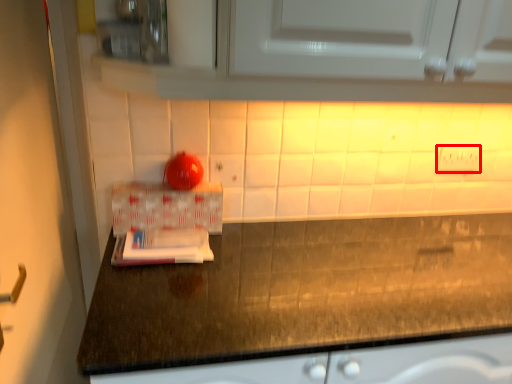
Question: From the image's perspective, where is electric outlet (annotated by the red box) located relative to box?

Choices:
 (A) below
 (B) above

Answer: (B)